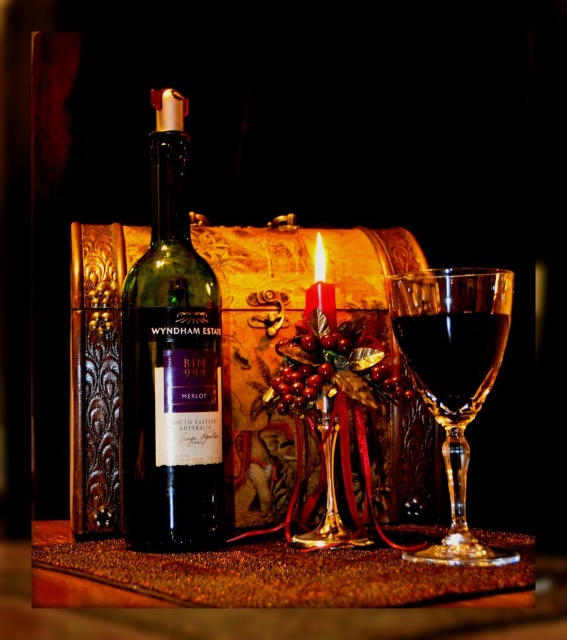
Question: Estimate the real-world distances between objects in this image. Which object is closer to the transparent glass at right?

Choices:
 (A) green glass bottle at center
 (B) shiny brown table at center
 (C) matte red candle at center

Answer: (C)

Question: Which point is closer to the camera?

Choices:
 (A) (36, 593)
 (B) (441, 381)

Answer: (A)

Question: Can you confirm if shiny brown table at center is positioned to the left of matte red candle at center?

Choices:
 (A) yes
 (B) no

Answer: (A)

Question: Which object is farther from the camera taking this photo?

Choices:
 (A) shiny brown table at center
 (B) dark glass wine at center
 (C) matte red candle at center
 (D) transparent glass at right

Answer: (C)

Question: Does dark glass wine at center have a lesser width compared to matte red candle at center?

Choices:
 (A) no
 (B) yes

Answer: (A)

Question: Does green glass bottle at center appear under dark glass wine at center?

Choices:
 (A) no
 (B) yes

Answer: (A)